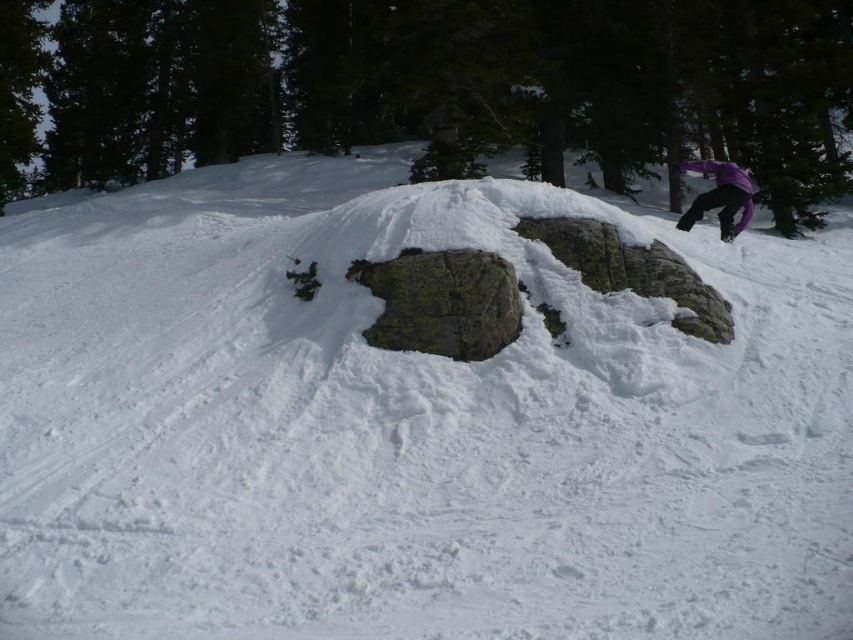
Question: Which object appears farthest from the camera in this image?

Choices:
 (A) purple matte snowboarder at upper right
 (B) gray rough rock at center

Answer: (A)

Question: Is gray rough rock at center smaller than purple matte snowboarder at upper right?

Choices:
 (A) no
 (B) yes

Answer: (B)

Question: Is gray rough rock at center below purple matte snowboarder at upper right?

Choices:
 (A) no
 (B) yes

Answer: (B)

Question: Does gray rough rock at center have a lesser width compared to purple matte snowboarder at upper right?

Choices:
 (A) yes
 (B) no

Answer: (B)

Question: Which of the following is the farthest from the observer?

Choices:
 (A) (734, 236)
 (B) (399, 324)

Answer: (A)